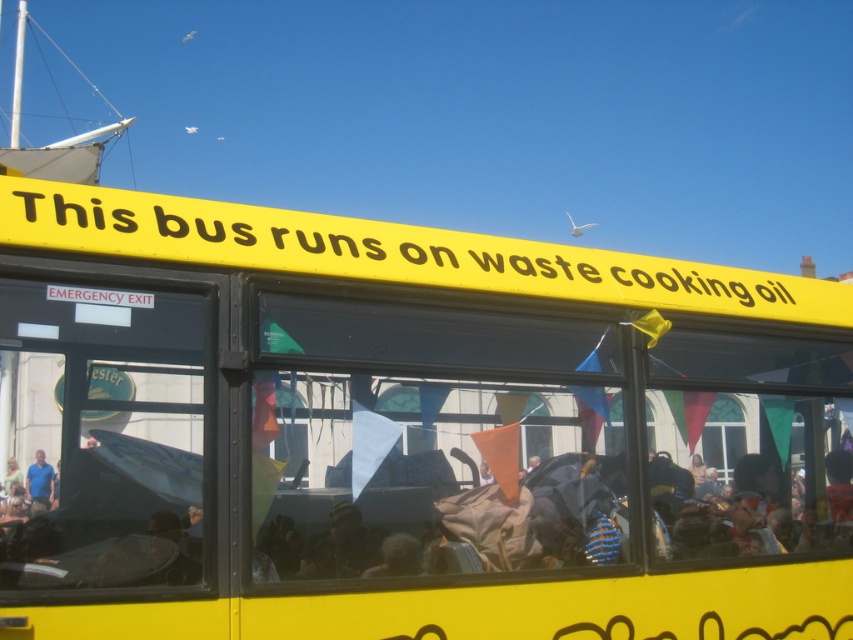
Question: Among these objects, which one is nearest to the camera?

Choices:
 (A) matte blue shirt at lower left
 (B) yellow matte bus at center

Answer: (B)

Question: From the image, what is the correct spatial relationship of yellow matte sign at upper center in relation to matte blue shirt at lower left?

Choices:
 (A) above
 (B) below

Answer: (A)

Question: Which object is farther from the camera taking this photo?

Choices:
 (A) matte blue shirt at lower left
 (B) matte black backpack at center
 (C) yellow matte sign at upper center
 (D) yellow matte bus at center

Answer: (C)

Question: Does yellow matte bus at center have a larger size compared to matte blue shirt at lower left?

Choices:
 (A) yes
 (B) no

Answer: (A)

Question: Which point is closer to the camera?

Choices:
 (A) yellow matte sign at upper center
 (B) matte black backpack at center
 (C) yellow matte bus at center
 (D) matte blue shirt at lower left

Answer: (C)

Question: Is yellow matte bus at center smaller than yellow matte sign at upper center?

Choices:
 (A) no
 (B) yes

Answer: (A)